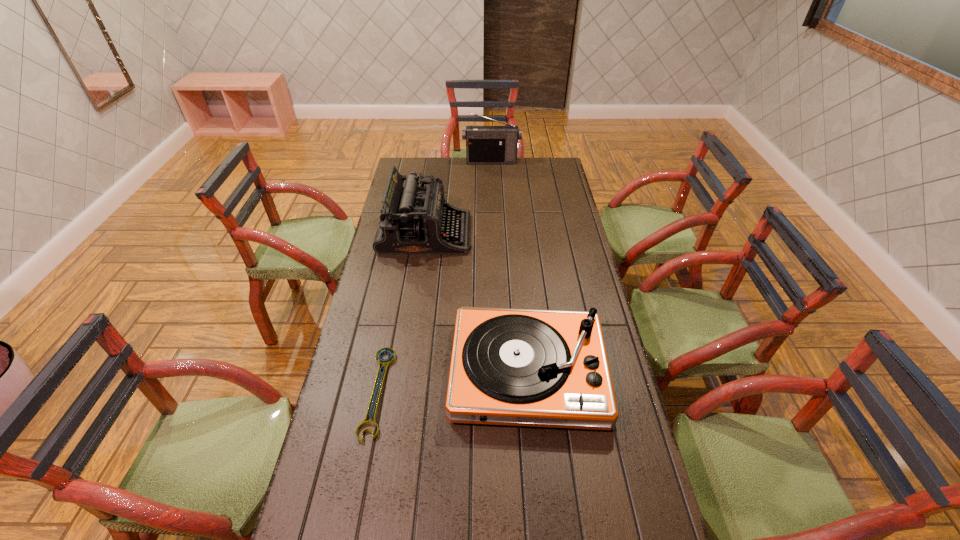
What are the coordinates of `wrench that is at the left edge` in the screenshot? It's located at (383, 362).

I want to click on object situated at the right edge, so click(521, 367).

Find the location of a particular element. This screenshot has height=540, width=960. vacant space at the left edge is located at coordinates (387, 259).

Where is `vacant space at the far right corner of the desktop`? vacant space at the far right corner of the desktop is located at coordinates (539, 159).

Where is `vacant point located between the wrench and the second farthest object`? Image resolution: width=960 pixels, height=540 pixels. vacant point located between the wrench and the second farthest object is located at coordinates (401, 313).

Where is `empty location between the record player and the second farthest object`? The height and width of the screenshot is (540, 960). empty location between the record player and the second farthest object is located at coordinates (477, 302).

Locate an element on the screen. The image size is (960, 540). free point between the typewriter and the third tallest object is located at coordinates (477, 302).

In order to click on free space between the third nearest object and the third tallest object in this screenshot , I will do `click(477, 302)`.

This screenshot has width=960, height=540. What are the coordinates of `free space between the farthest object and the second farthest object` in the screenshot? It's located at (459, 198).

Where is `empty location between the typewriter and the second shortest object`? The width and height of the screenshot is (960, 540). empty location between the typewriter and the second shortest object is located at coordinates (477, 302).